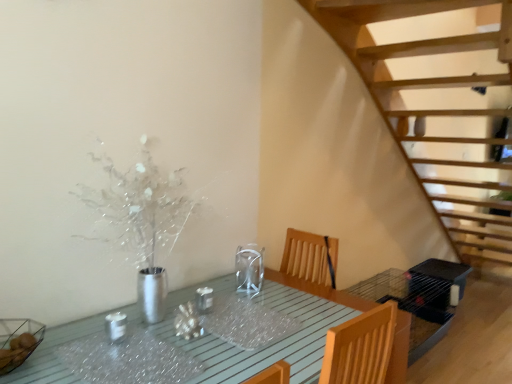
Identify the location of clear glass table at center. (271, 345).

What do you see at coordinates (271, 345) in the screenshot?
I see `clear glass table at center` at bounding box center [271, 345].

The width and height of the screenshot is (512, 384). In order to click on clear glass table at center in this screenshot , I will do `click(271, 345)`.